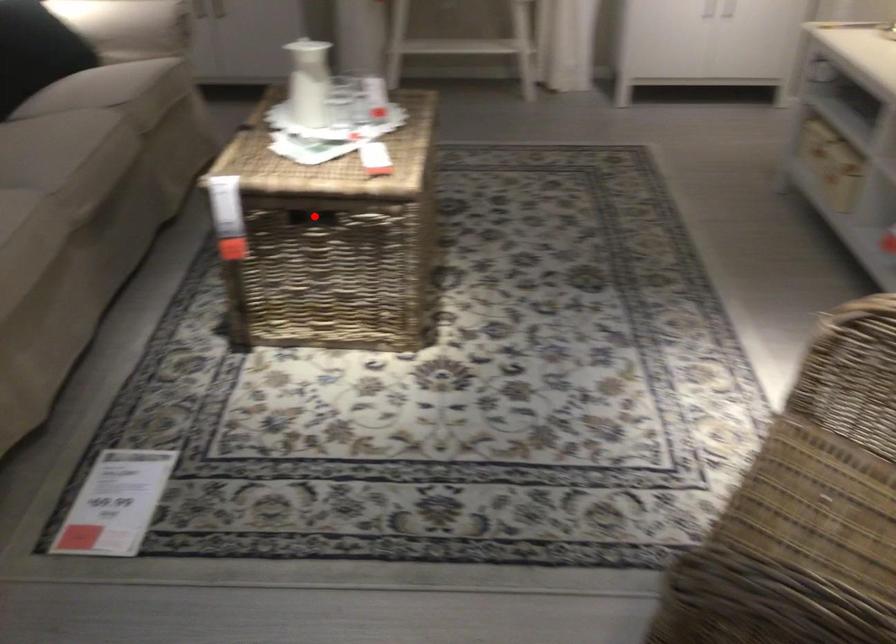
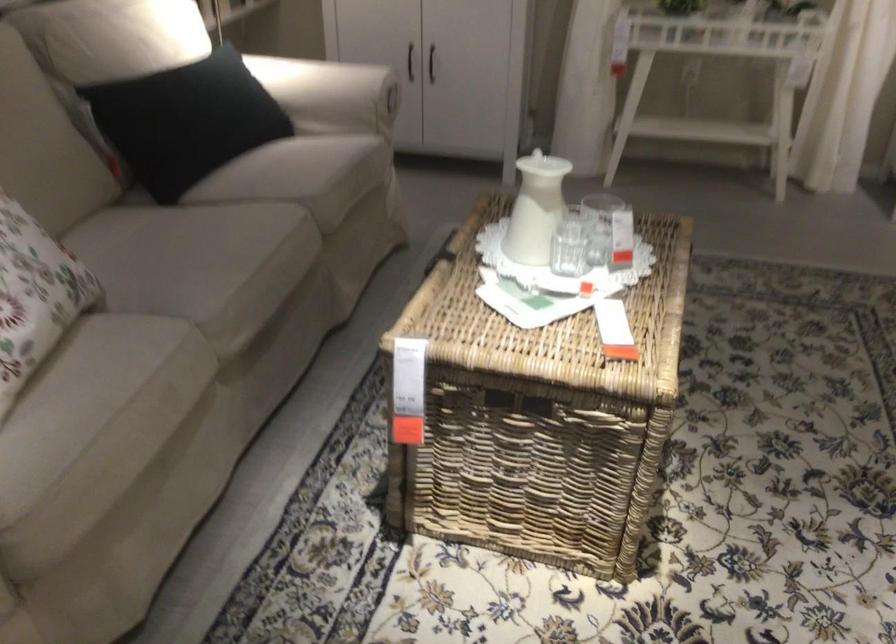
Question: I am providing you with two images of the same scene from different viewpoints. A red point is marked on the first image. Can you still see the location of the red point in image 2?

Choices:
 (A) Yes
 (B) No

Answer: (B)